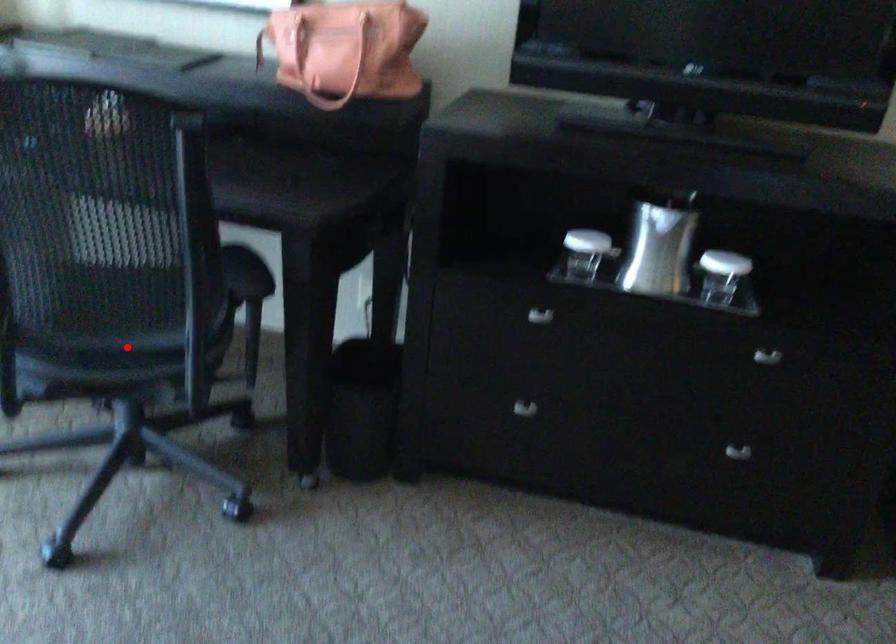
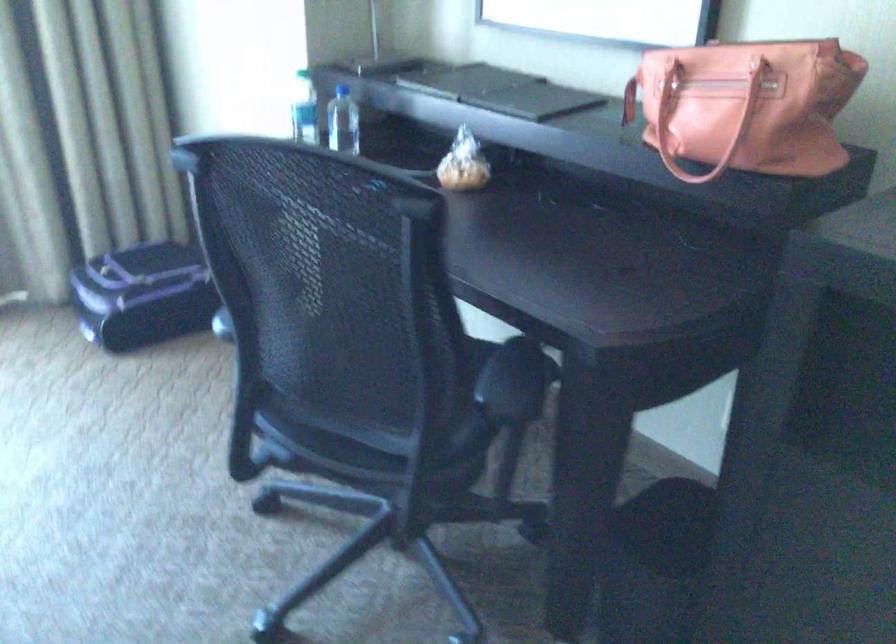
In the second image, find the point that corresponds to the highlighted location in the first image.

(364, 440)